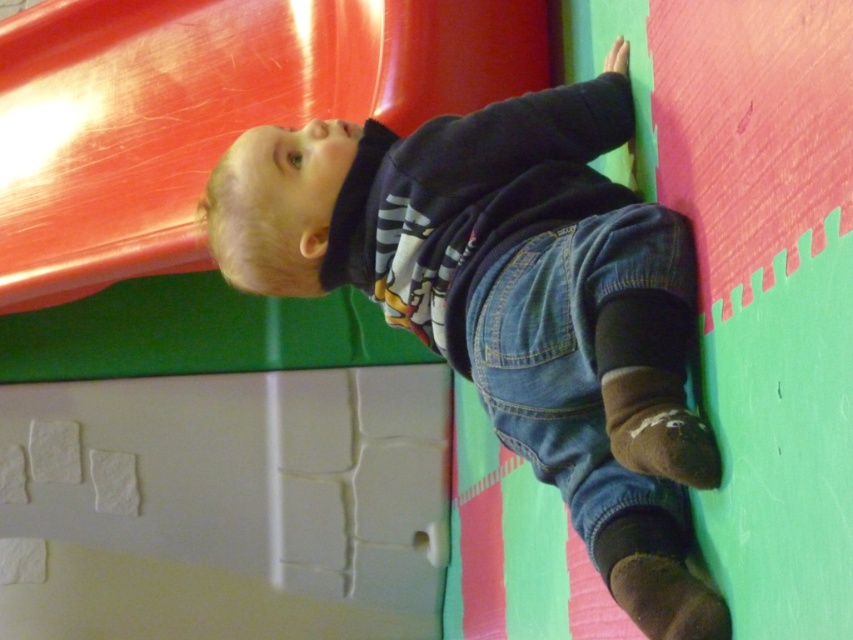
You are a parent watching your child play in an indoor play area. You notice two items made of denim in the scene. The first is the denim overalls at center, and the second is denim at lower right. Which denim item is higher up in the image?

The denim overalls at center is located above denim at lower right, so the denim overalls at center is higher up in the image.

You are a parent watching your child play in an indoor play area. You see your child wearing denim overalls at center and there is a shiny plastic slide at upper left. If the child wants to reach the slide from their current position, will they have to move more than 3 feet?

The denim overalls at center and shiny plastic slide at upper left are 32.72 inches apart from each other. Since 32.72 inches is approximately 2.73 feet, the child will not have to move more than 3 feet to reach the slide.